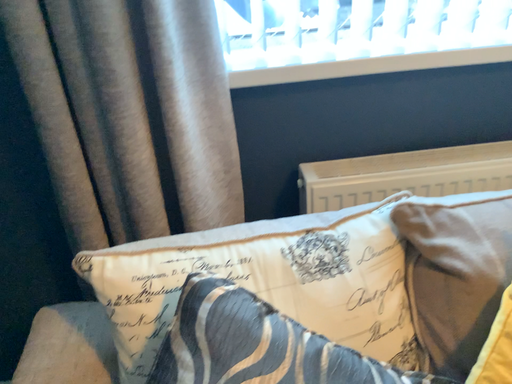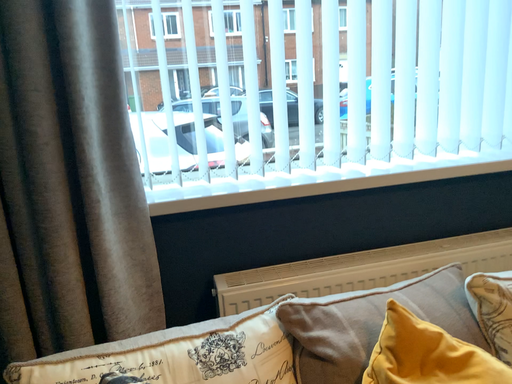
Question: How did the camera likely rotate when shooting the video?

Choices:
 (A) rotated right
 (B) rotated left

Answer: (A)